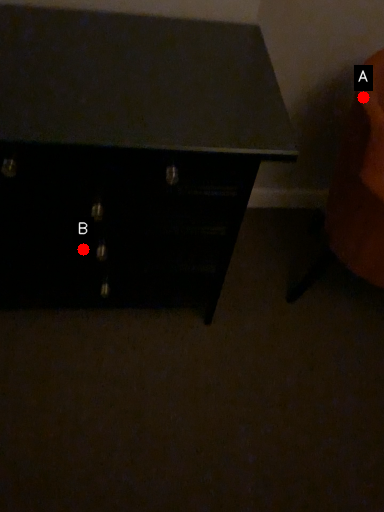
Question: Two points are circled on the image, labeled by A and B beside each circle. Which point appears farthest from the camera in this image?

Choices:
 (A) A is further
 (B) B is further

Answer: (B)